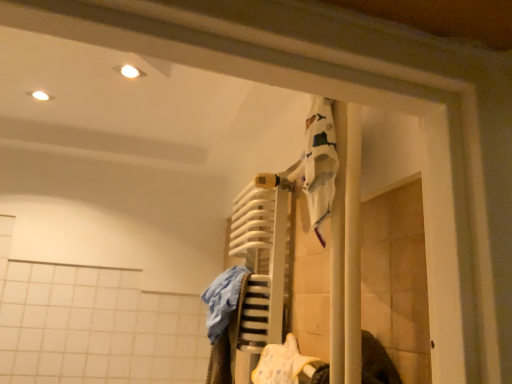
The height and width of the screenshot is (384, 512). In order to click on yellow fabric at lower center, the first clothing when ordered from right to left in this screenshot , I will do `click(282, 363)`.

Image resolution: width=512 pixels, height=384 pixels. What do you see at coordinates (282, 363) in the screenshot?
I see `yellow fabric at lower center, the first clothing when ordered from right to left` at bounding box center [282, 363].

In the scene shown: Measure the distance between point (269,361) and camera.

The depth of point (269,361) is 1.20 meters.

In order to face blue cotton towel at center, acting as the second clothing starting from the right, should I rotate leftwards or rightwards?

You should rotate left by 4.691 degrees.

At what (x,y) coordinates should I click in order to perform the action: click on blue cotton towel at center, acting as the second clothing starting from the right. Please return your answer as a coordinate pair (x, y). The image size is (512, 384). Looking at the image, I should click on (224, 322).

How much space does blue cotton towel at center, acting as the second clothing starting from the right, occupy horizontally?

blue cotton towel at center, acting as the second clothing starting from the right, is 16.76 centimeters wide.

Describe the element at coordinates (224, 322) in the screenshot. I see `blue cotton towel at center, acting as the second clothing starting from the right` at that location.

What are the coordinates of `yellow fabric at lower center, which is the second clothing from left to right` in the screenshot? It's located at (282, 363).

Between blue cotton towel at center, which appears as the 1th clothing when viewed from the left, and yellow fabric at lower center, the first clothing when ordered from right to left, which one appears on the left side from the viewer's perspective?

Positioned to the left is blue cotton towel at center, which appears as the 1th clothing when viewed from the left.

Does blue cotton towel at center, acting as the second clothing starting from the right, come behind yellow fabric at lower center, the first clothing when ordered from right to left?

Yes, blue cotton towel at center, acting as the second clothing starting from the right, is further from the viewer.

Is point (246, 277) behind point (309, 363)?

That is True.

From the image's perspective, which object appears higher, blue cotton towel at center, acting as the second clothing starting from the right, or yellow fabric at lower center, the first clothing when ordered from right to left?

From the image's view, blue cotton towel at center, acting as the second clothing starting from the right, is above.

From a real-world perspective, is blue cotton towel at center, acting as the second clothing starting from the right, physically below yellow fabric at lower center, which is the second clothing from left to right?

Actually, blue cotton towel at center, acting as the second clothing starting from the right, is physically above yellow fabric at lower center, which is the second clothing from left to right, in the real world.

Consider the image. Is blue cotton towel at center, which appears as the 1th clothing when viewed from the left, wider than yellow fabric at lower center, the first clothing when ordered from right to left?

Yes, blue cotton towel at center, which appears as the 1th clothing when viewed from the left, is wider than yellow fabric at lower center, the first clothing when ordered from right to left.

Considering the relative sizes of blue cotton towel at center, which appears as the 1th clothing when viewed from the left, and yellow fabric at lower center, which is the second clothing from left to right, in the image provided, is blue cotton towel at center, which appears as the 1th clothing when viewed from the left, shorter than yellow fabric at lower center, which is the second clothing from left to right,?

No.

Considering the sizes of blue cotton towel at center, acting as the second clothing starting from the right, and yellow fabric at lower center, which is the second clothing from left to right, in the image, is blue cotton towel at center, acting as the second clothing starting from the right, bigger or smaller than yellow fabric at lower center, which is the second clothing from left to right,?

Clearly, blue cotton towel at center, acting as the second clothing starting from the right, is larger in size than yellow fabric at lower center, which is the second clothing from left to right.

Looking at this image, is yellow fabric at lower center, which is the second clothing from left to right, inside blue cotton towel at center, which appears as the 1th clothing when viewed from the left?

No, yellow fabric at lower center, which is the second clothing from left to right, is not surrounded by blue cotton towel at center, which appears as the 1th clothing when viewed from the left.

Is blue cotton towel at center, which appears as the 1th clothing when viewed from the left, not near yellow fabric at lower center, the first clothing when ordered from right to left?

No.

Based on the photo, is blue cotton towel at center, which appears as the 1th clothing when viewed from the left, aimed at yellow fabric at lower center, which is the second clothing from left to right?

No, blue cotton towel at center, which appears as the 1th clothing when viewed from the left, is not aimed at yellow fabric at lower center, which is the second clothing from left to right.

Measure the distance between blue cotton towel at center, acting as the second clothing starting from the right, and yellow fabric at lower center, the first clothing when ordered from right to left.

They are 8.18 inches apart.

What are the coordinates of `clothing above the yellow fabric at lower center, the first clothing when ordered from right to left (from a real-world perspective)` in the screenshot? It's located at (224, 322).

Would you say yellow fabric at lower center, the first clothing when ordered from right to left, is to the left or to the right of blue cotton towel at center, acting as the second clothing starting from the right, in the picture?

yellow fabric at lower center, the first clothing when ordered from right to left, is to the right of blue cotton towel at center, acting as the second clothing starting from the right.

Considering their positions, is yellow fabric at lower center, the first clothing when ordered from right to left, located in front of or behind blue cotton towel at center, acting as the second clothing starting from the right?

yellow fabric at lower center, the first clothing when ordered from right to left, is positioned closer to the viewer than blue cotton towel at center, acting as the second clothing starting from the right.

Does point (302, 363) appear closer or farther from the camera than point (237, 335)?

Point (302, 363) is closer to the camera than point (237, 335).

From the image's perspective, is yellow fabric at lower center, which is the second clothing from left to right, beneath blue cotton towel at center, which appears as the 1th clothing when viewed from the left?

Yes, from the image's perspective, yellow fabric at lower center, which is the second clothing from left to right, is below blue cotton towel at center, which appears as the 1th clothing when viewed from the left.

From a real-world perspective, is yellow fabric at lower center, the first clothing when ordered from right to left, beneath blue cotton towel at center, acting as the second clothing starting from the right?

Yes.

Does yellow fabric at lower center, the first clothing when ordered from right to left, have a lesser width compared to blue cotton towel at center, acting as the second clothing starting from the right?

Yes, yellow fabric at lower center, the first clothing when ordered from right to left, is thinner than blue cotton towel at center, acting as the second clothing starting from the right.

Does yellow fabric at lower center, the first clothing when ordered from right to left, have a greater height compared to blue cotton towel at center, acting as the second clothing starting from the right?

Incorrect, the height of yellow fabric at lower center, the first clothing when ordered from right to left, is not larger of that of blue cotton towel at center, acting as the second clothing starting from the right.

Considering the sizes of yellow fabric at lower center, which is the second clothing from left to right, and blue cotton towel at center, acting as the second clothing starting from the right, in the image, is yellow fabric at lower center, which is the second clothing from left to right, bigger or smaller than blue cotton towel at center, acting as the second clothing starting from the right,?

Considering their sizes, yellow fabric at lower center, which is the second clothing from left to right, takes up less space than blue cotton towel at center, acting as the second clothing starting from the right.

Is yellow fabric at lower center, the first clothing when ordered from right to left, not within blue cotton towel at center, acting as the second clothing starting from the right?

yellow fabric at lower center, the first clothing when ordered from right to left, lies outside blue cotton towel at center, acting as the second clothing starting from the right,'s area.

Is yellow fabric at lower center, which is the second clothing from left to right, far from blue cotton towel at center, which appears as the 1th clothing when viewed from the left?

Actually, yellow fabric at lower center, which is the second clothing from left to right, and blue cotton towel at center, which appears as the 1th clothing when viewed from the left, are a little close together.

Is yellow fabric at lower center, which is the second clothing from left to right, oriented towards blue cotton towel at center, which appears as the 1th clothing when viewed from the left?

No.

Consider the image. How distant is yellow fabric at lower center, which is the second clothing from left to right, from blue cotton towel at center, which appears as the 1th clothing when viewed from the left?

yellow fabric at lower center, which is the second clothing from left to right, is 8.18 inches from blue cotton towel at center, which appears as the 1th clothing when viewed from the left.

Locate an element on the screen. This screenshot has width=512, height=384. clothing above the yellow fabric at lower center, which is the second clothing from left to right (from a real-world perspective) is located at coordinates (224, 322).

Image resolution: width=512 pixels, height=384 pixels. I want to click on clothing located above the yellow fabric at lower center, which is the second clothing from left to right (from a real-world perspective), so click(x=224, y=322).

Where is `clothing behind the yellow fabric at lower center, which is the second clothing from left to right`? clothing behind the yellow fabric at lower center, which is the second clothing from left to right is located at coordinates (224, 322).